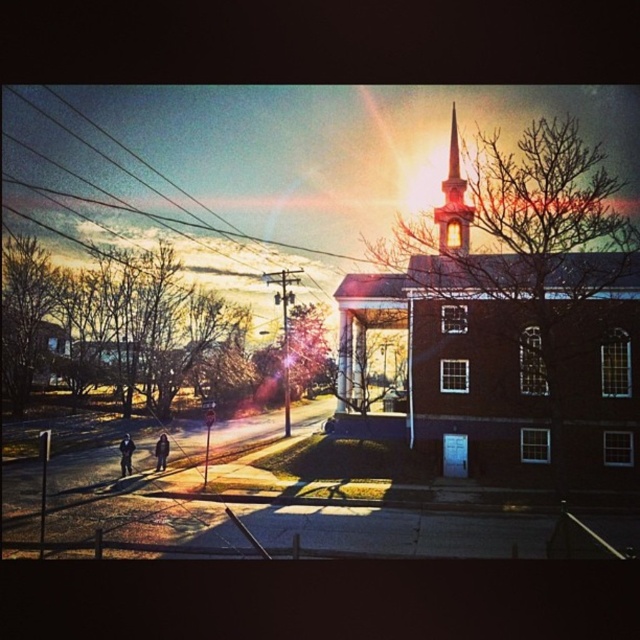
You are an architect analyzing the layout of the image. You notice the brick church at center and the metallic wires at upper left. Which object is located more to the right in the scene?

The brick church at center is positioned on the right side of metallic wires at upper left, so it is more to the right.

You are standing at the coordinates 0.5, 0.8 in the image. Which direction should you move to get closer to the brick church at center?

Since the brick church at center is located at point [513,332], you should move slightly to the right and upwards from your current position at [512,320] to get closer to it.

Looking at this image, you are a photographer standing 5 meters away from the brick church at center. You want to take a photo of the smooth brick steeple at upper center. Can you reach the steeple without moving closer than your current position?

The distance between the brick church at center and the smooth brick steeple at upper center is 6.21 meters. Since you are already 5 meters away from the brick church at center, you are within the required distance to capture the smooth brick steeple at upper center without needing to move closer.